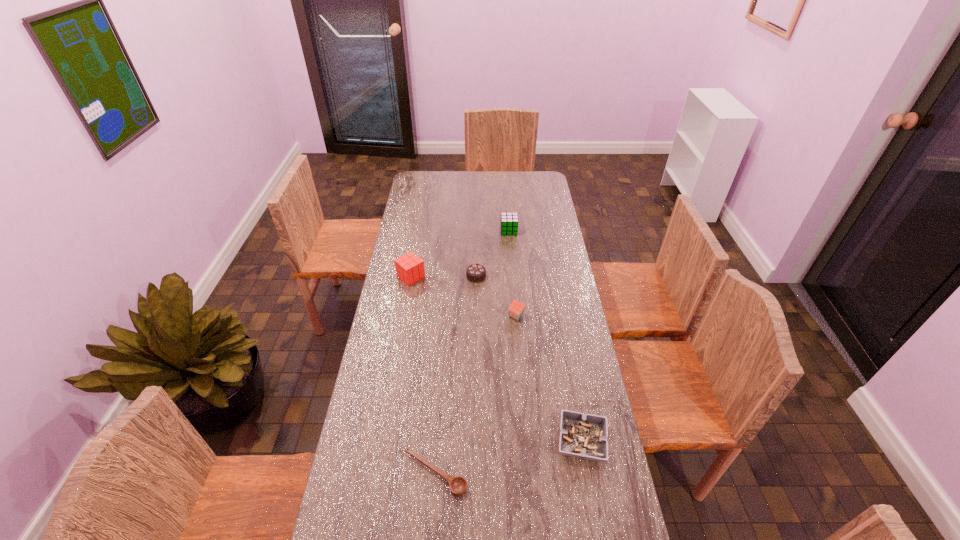
What are the coordinates of `free area in between the nearest cube and the farthest cube` in the screenshot? It's located at (513, 273).

Locate which object is the third closest to the shortest object. Please provide its 2D coordinates. Your answer should be formatted as a tuple, i.e. [(x, y)], where the tuple contains the x and y coordinates of a point satisfying the conditions above.

[(409, 268)]

Identify which object is located as the third nearest to the shortest cube. Please provide its 2D coordinates. Your answer should be formatted as a tuple, i.e. [(x, y)], where the tuple contains the x and y coordinates of a point satisfying the conditions above.

[(584, 436)]

This screenshot has height=540, width=960. I want to click on cube that stands as the second closest to the farthest cube, so click(x=516, y=309).

Point out which cube is positioned as the nearest to the leftmost object. Please provide its 2D coordinates. Your answer should be formatted as a tuple, i.e. [(x, y)], where the tuple contains the x and y coordinates of a point satisfying the conditions above.

[(516, 309)]

Where is `blank area in the image that satisfies the following two spatial constraints: 1. on the front side of the wooden spoon; 2. on the right side of the leftmost cube`? The image size is (960, 540). blank area in the image that satisfies the following two spatial constraints: 1. on the front side of the wooden spoon; 2. on the right side of the leftmost cube is located at coordinates (376, 474).

This screenshot has height=540, width=960. I want to click on vacant space that satisfies the following two spatial constraints: 1. on the front side of the chocolate cake; 2. on the left side of the fifth tallest object, so click(x=474, y=441).

This screenshot has width=960, height=540. In order to click on vacant area that satisfies the following two spatial constraints: 1. on the back side of the ashtray; 2. on the right side of the wooden spoon in this screenshot , I will do `click(438, 441)`.